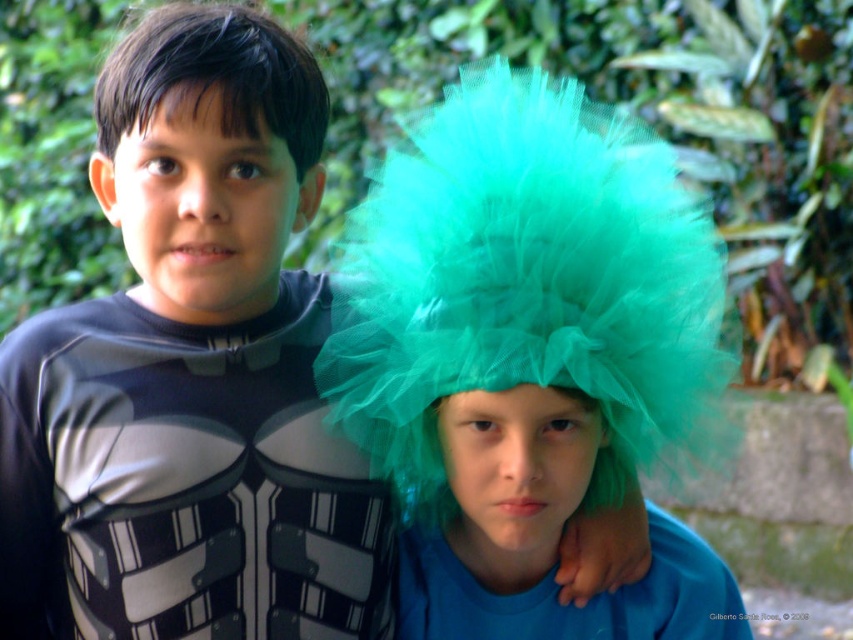
Between point (514, 241) and point (280, 116), which one is positioned behind?

Positioned behind is point (280, 116).

Looking at this image, is turquoise tulle wig at center positioned before green tulle wig at upper center?

Yes, turquoise tulle wig at center is closer to the viewer.

Does point (494, 211) come closer to viewer compared to point (273, 65)?

Yes.

Image resolution: width=853 pixels, height=640 pixels. In order to click on turquoise tulle wig at center in this screenshot , I will do `click(531, 362)`.

Does teal tulle wig at center appear on the right side of green tulle wig at upper center?

Correct, you'll find teal tulle wig at center to the right of green tulle wig at upper center.

Who is shorter, teal tulle wig at center or green tulle wig at upper center?

green tulle wig at upper center

Who is more forward, (x=660, y=588) or (x=103, y=81)?

Point (x=103, y=81)

Find the location of a particular element. teal tulle wig at center is located at coordinates (543, 536).

Can you confirm if turquoise tulle wig at center is bigger than teal tulle wig at center?

Yes.

Does turquoise tulle wig at center appear on the right side of teal tulle wig at center?

Yes, turquoise tulle wig at center is to the right of teal tulle wig at center.

Is point (514, 394) closer to viewer compared to point (497, 625)?

That is True.

Identify the location of turquoise tulle wig at center. The width and height of the screenshot is (853, 640). (531, 362).